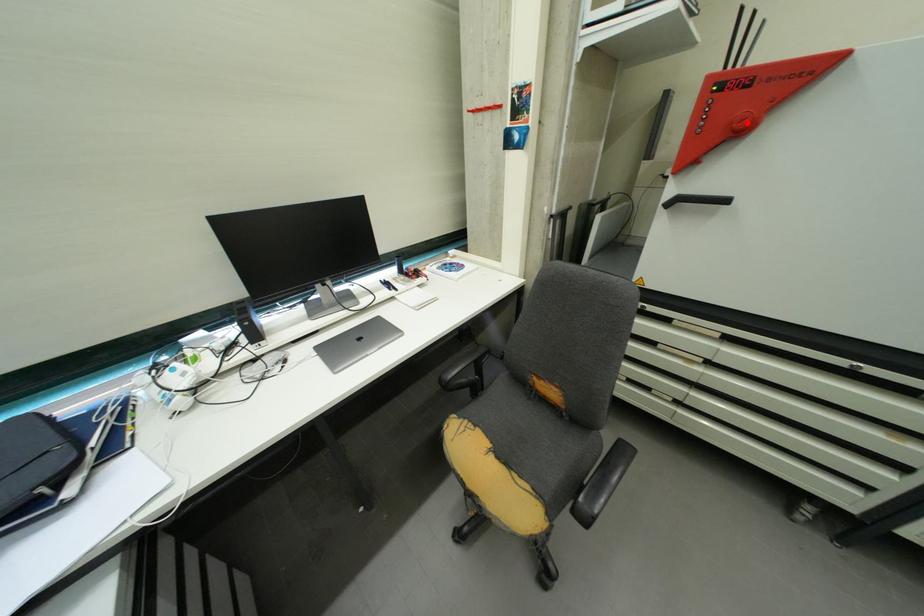
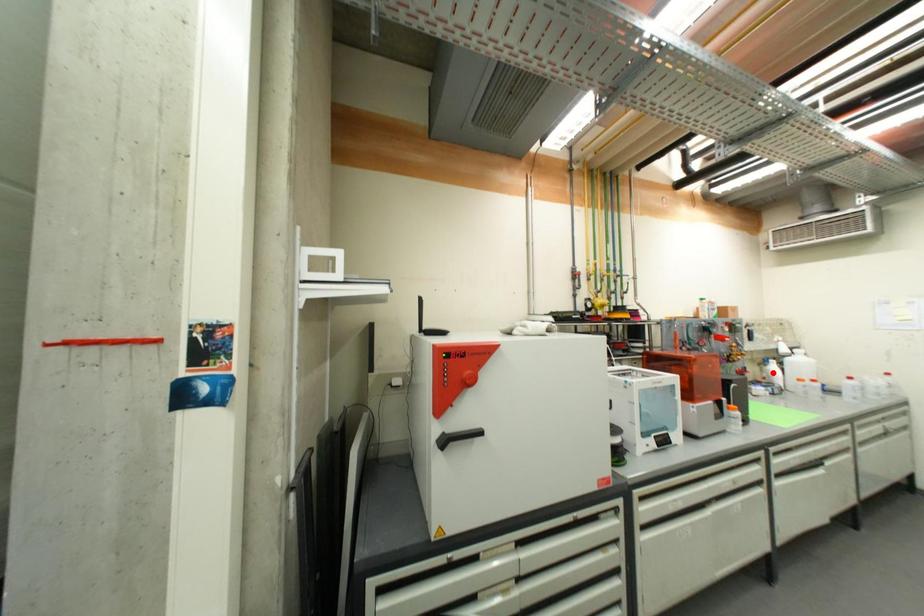
I am providing you with two images of the same scene from different viewpoints. A red point is marked on the first image and another point is marked on the second image. Do the highlighted points in image1 and image2 indicate the same real-world spot?

No